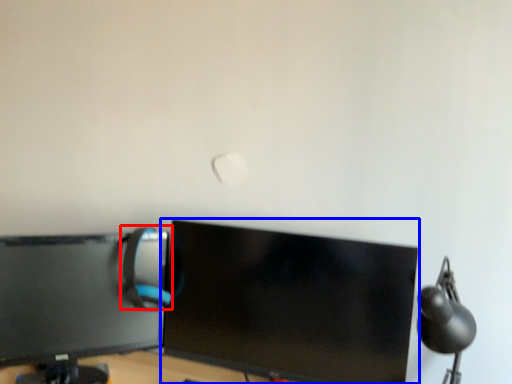
Question: Which of the following is the closest to the observer, computer chair (highlighted by a red box) or computer monitor (highlighted by a blue box)?

Choices:
 (A) computer chair
 (B) computer monitor

Answer: (B)